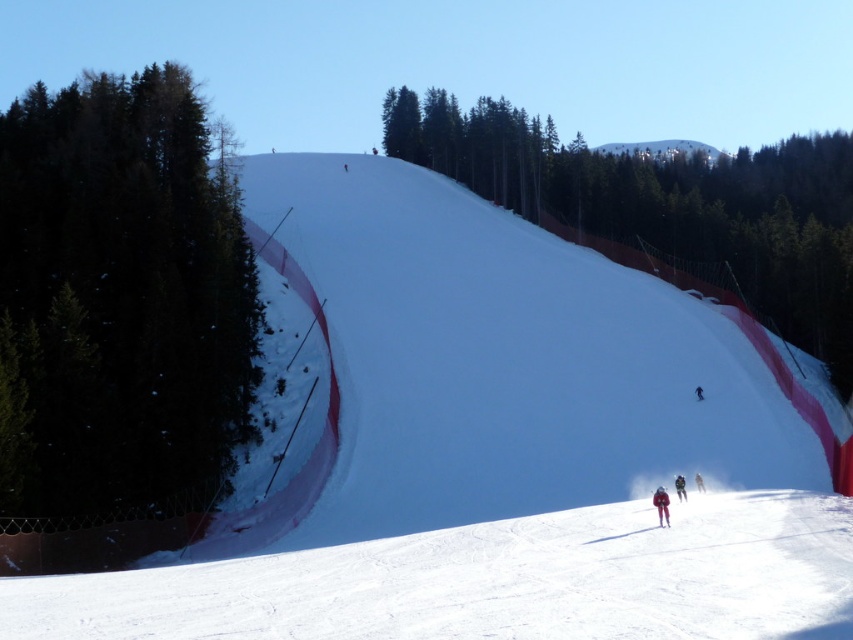
Who is positioned more to the left, green matte tree at center or black matte skier at center?

black matte skier at center is more to the left.

Is green matte tree at center below black matte skier at center?

No.

The height and width of the screenshot is (640, 853). In order to click on green matte tree at center in this screenshot , I will do `click(669, 205)`.

The width and height of the screenshot is (853, 640). Describe the element at coordinates (699, 392) in the screenshot. I see `black matte skier at center` at that location.

Can you confirm if black matte skier at center is positioned to the right of white matte ski at center?

Indeed, black matte skier at center is positioned on the right side of white matte ski at center.

What do you see at coordinates (699, 392) in the screenshot? I see `black matte skier at center` at bounding box center [699, 392].

Locate an element on the screen. Image resolution: width=853 pixels, height=640 pixels. black matte skier at center is located at coordinates (699, 392).

Does point (770, 272) come farther from viewer compared to point (698, 474)?

That is True.

This screenshot has height=640, width=853. What are the coordinates of `green matte tree at center` in the screenshot? It's located at (669, 205).

Which is behind, point (409, 147) or point (694, 477)?

The point (409, 147) is more distant.

Image resolution: width=853 pixels, height=640 pixels. I want to click on green matte tree at center, so click(x=669, y=205).